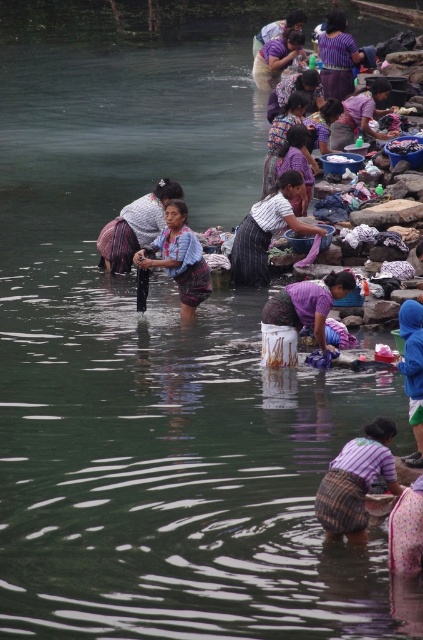
Question: Is white woven cloth at center closer to camera compared to blue fabric pants at lower right?

Choices:
 (A) yes
 (B) no

Answer: (B)

Question: Which of the following is the closest to the observer?

Choices:
 (A) white woven cloth at center
 (B) matte purple shirt at upper center
 (C) purple fabric at center

Answer: (A)

Question: Estimate the real-world distances between objects in this image. Which object is farther from the brown woven skirt at lower center?

Choices:
 (A) purple woven fabric at upper center
 (B) purple woven skirt at lower center

Answer: (A)

Question: Which object appears farthest from the camera in this image?

Choices:
 (A) blue woven skirt at center
 (B) striped fabric skirt at center
 (C) textured purple blouse at center

Answer: (C)

Question: Does purple woven fabric at center have a greater width compared to purple fabric at center?

Choices:
 (A) yes
 (B) no

Answer: (A)

Question: Can you confirm if blue fabric pants at lower right is positioned above purple fabric at center?

Choices:
 (A) no
 (B) yes

Answer: (A)